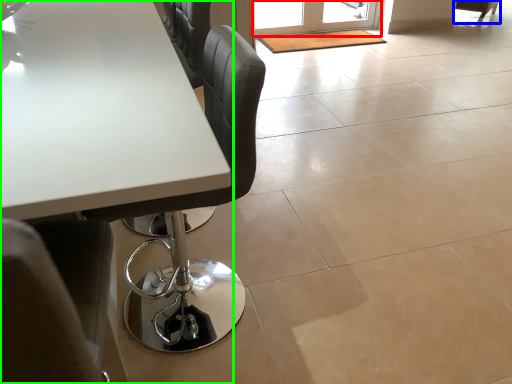
Question: Which object is the closest to the screen door (highlighted by a red box)? Choose among these: chair (highlighted by a blue box) or table (highlighted by a green box).

Choices:
 (A) chair
 (B) table

Answer: (A)